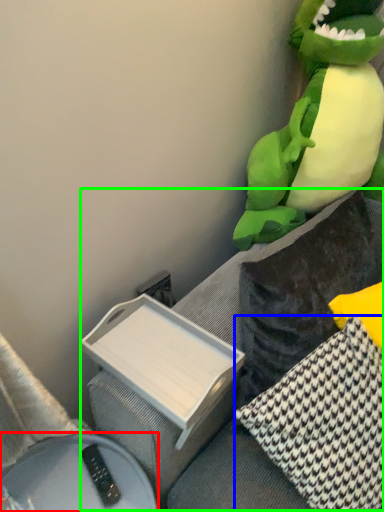
Question: Based on their relative distances, which object is farther from furniture (highlighted by a red box)? Choose from pillow (highlighted by a blue box) and couch (highlighted by a green box).

Choices:
 (A) pillow
 (B) couch

Answer: (A)